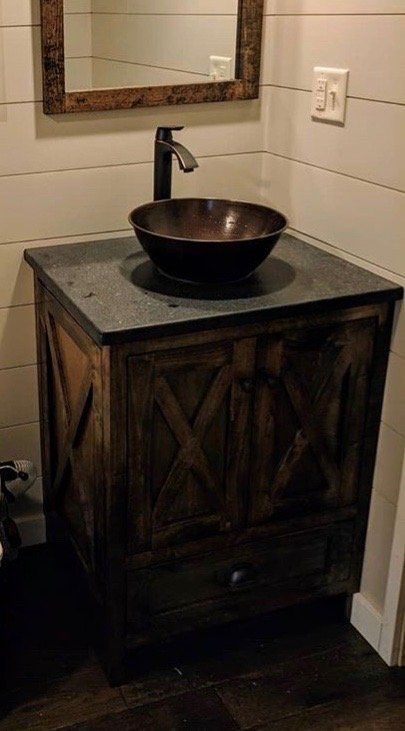
Where is `sink faucet`? The image size is (405, 731). sink faucet is located at coordinates (186, 159).